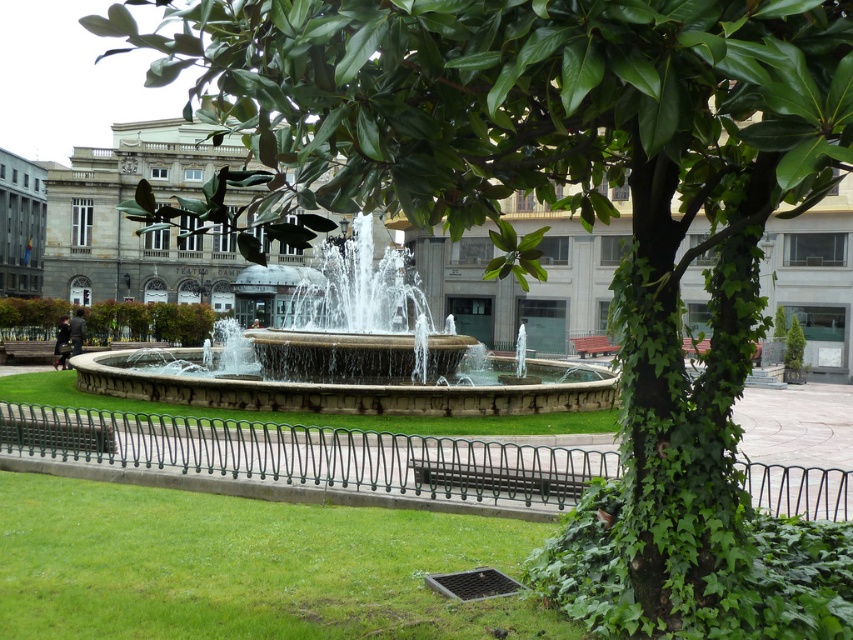
You are a park visitor sitting on the wooden bench at center. You want to see the water jets of the stone fountain at center more clearly. Which direction should you look?

The stone fountain at center is above the wooden bench at center, so you should look upward to see the water jets of the stone fountain at center more clearly.